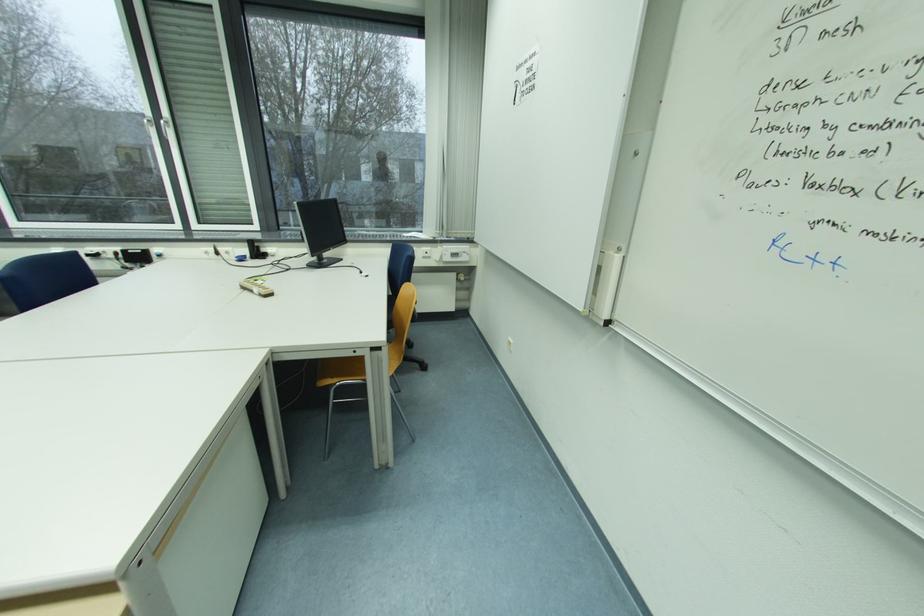
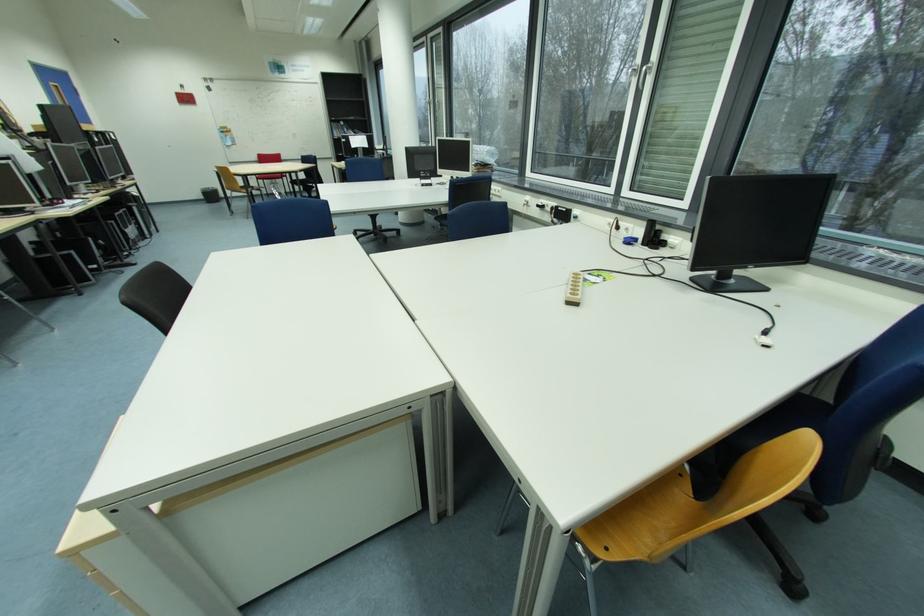
In the second image, find the point that corresponds to (x=169, y=123) in the first image.

(651, 69)